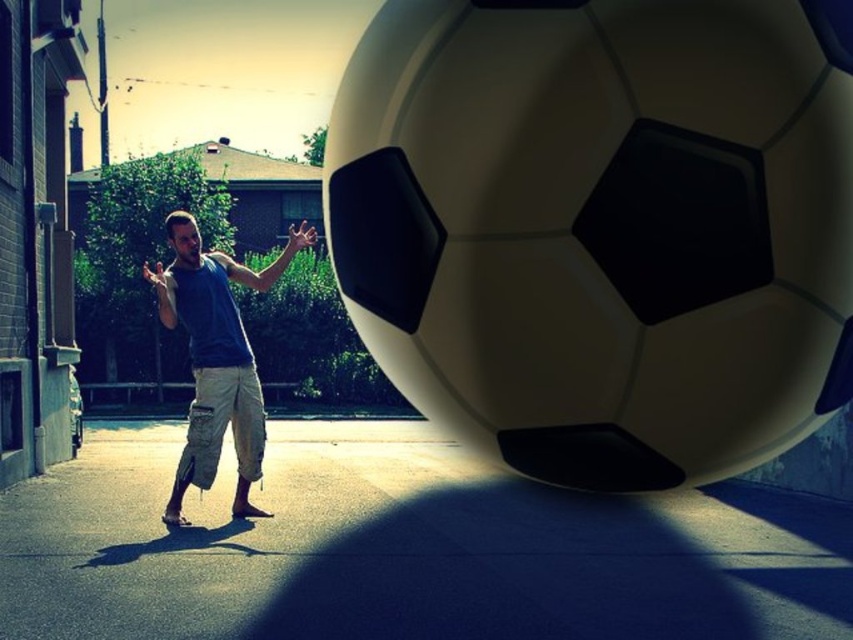
Question: Can you confirm if smooth concrete pavement at lower center is thinner than blue cotton tank top at center?

Choices:
 (A) yes
 (B) no

Answer: (B)

Question: Among these objects, which one is farthest from the camera?

Choices:
 (A) blue cotton tank top at center
 (B) smooth concrete pavement at lower center

Answer: (A)

Question: Is smooth concrete pavement at lower center smaller than blue cotton tank top at center?

Choices:
 (A) yes
 (B) no

Answer: (B)

Question: Does smooth concrete pavement at lower center lie behind blue cotton tank top at center?

Choices:
 (A) yes
 (B) no

Answer: (B)